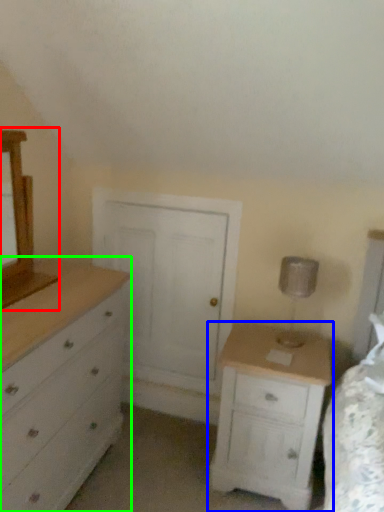
Question: Based on their relative distances, which object is nearer to medicine cabinet (highlighted by a red box)? Choose from nightstand (highlighted by a blue box) and chest of drawers (highlighted by a green box).

Choices:
 (A) nightstand
 (B) chest of drawers

Answer: (B)